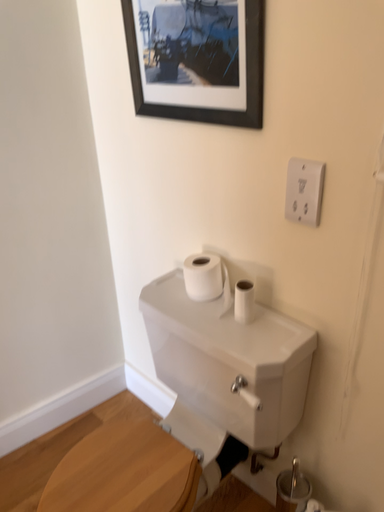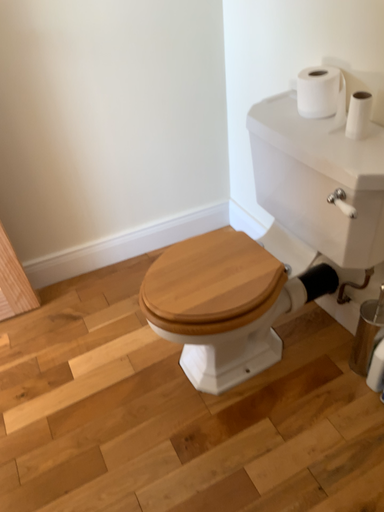
Question: How did the camera likely rotate when shooting the video?

Choices:
 (A) rotated downward
 (B) rotated upward

Answer: (A)